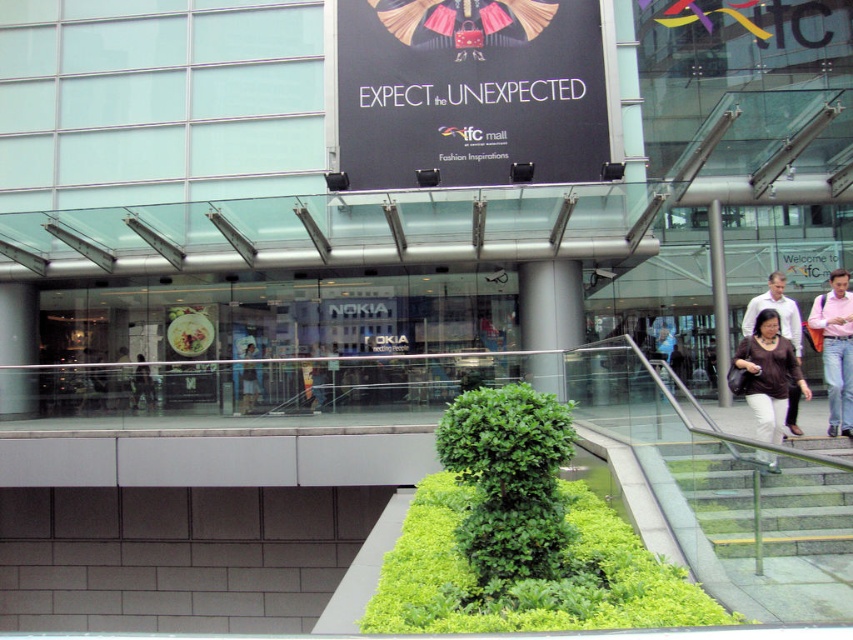
Question: Can you confirm if black matte sign at upper center is thinner than green granite stairs at lower right?

Choices:
 (A) no
 (B) yes

Answer: (A)

Question: Among these objects, which one is nearest to the camera?

Choices:
 (A) pink cotton shirt at right
 (B) matte black dress at center

Answer: (A)

Question: Which of the following is the farthest from the observer?

Choices:
 (A) matte black dress at center
 (B) brown matte shirt at lower right
 (C) silvery metallic phone at center
 (D) pink cotton shirt at right

Answer: (C)

Question: Is black matte sign at upper center to the right of brown matte shirt at lower right from the viewer's perspective?

Choices:
 (A) no
 (B) yes

Answer: (A)

Question: Among these points, which one is farthest from the camera?

Choices:
 (A) (785, 513)
 (B) (245, 369)

Answer: (B)

Question: Is green granite stairs at lower right closer to camera compared to silvery metallic phone at center?

Choices:
 (A) yes
 (B) no

Answer: (A)